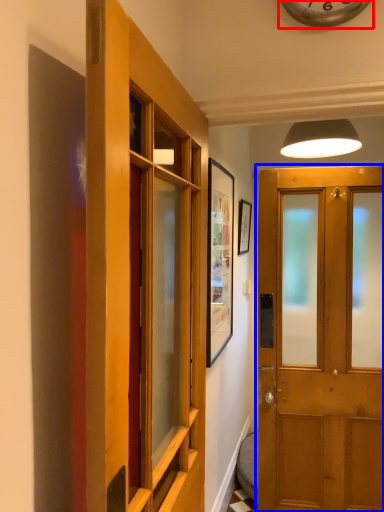
Question: Among these objects, which one is farthest to the camera, clock (highlighted by a red box) or door (highlighted by a blue box)?

Choices:
 (A) clock
 (B) door

Answer: (A)